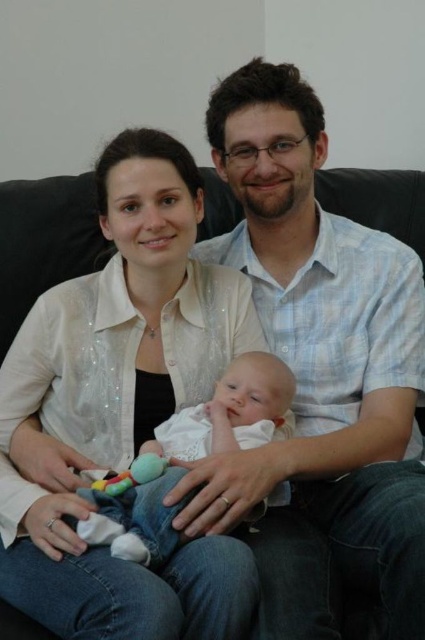
Looking at this image, you are a photographer trying to capture a closeup of the white glittery blouse at center and the white soft fabric baby at center. Since both are in the center, how can you adjust your camera to focus on the smaller object?

The white glittery blouse at center is larger than the white soft fabric baby at center, so to focus on the smaller object, you can zoom in slightly or adjust the camera angle to ensure the white soft fabric baby at center fills more of the frame.

You are a photographer setting up for a family portrait. You need to ensure that the blue plaid shirt at center and the white soft fabric baby at center are both visible in the photo. Based on their positions, is there a risk that one might cover the other in the image?

The blue plaid shirt at center is positioned over the white soft fabric baby at center, so there is a risk that the blue plaid shirt at center might cover the white soft fabric baby at center in the photo.